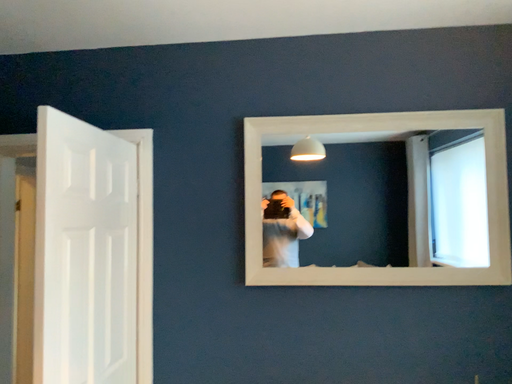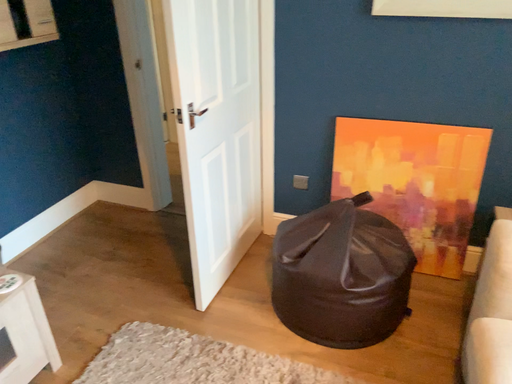
Question: Which way did the camera rotate in the video?

Choices:
 (A) rotated left
 (B) rotated right

Answer: (A)